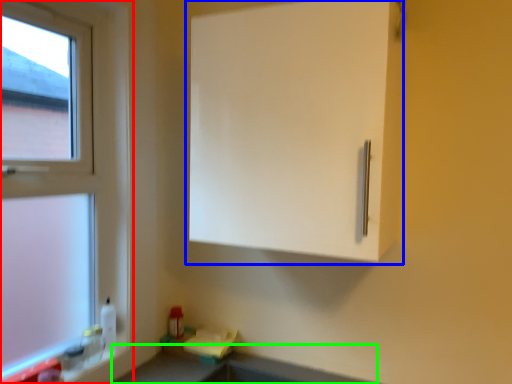
Question: Which object is positioned closest to window (highlighted by a red box)? Select from cabinetry (highlighted by a blue box) and counter top (highlighted by a green box).

Choices:
 (A) cabinetry
 (B) counter top

Answer: (A)